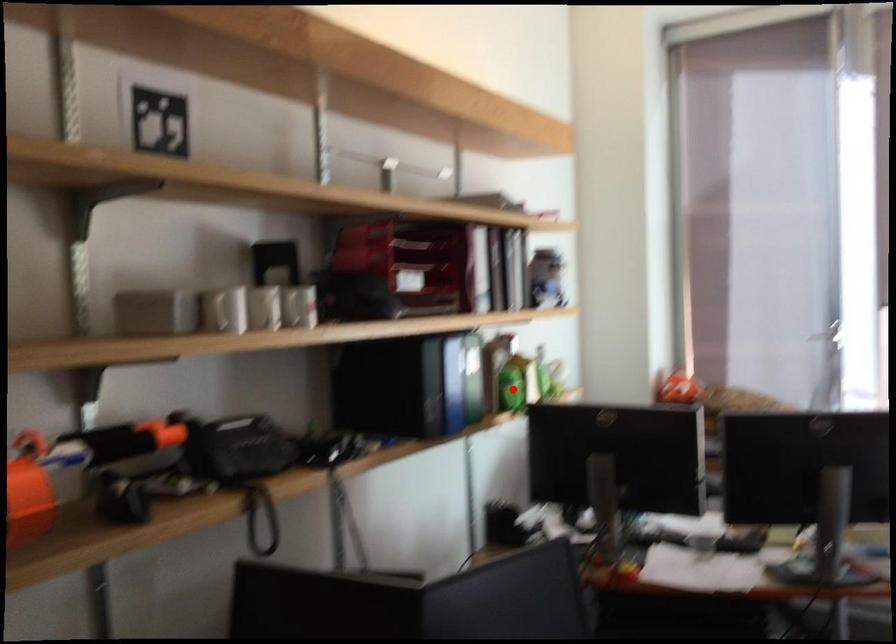
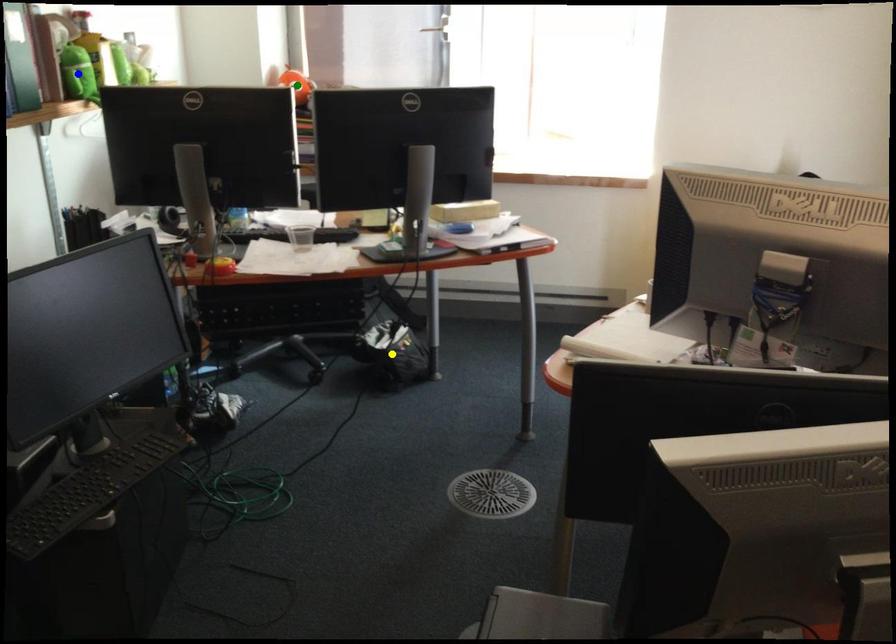
Question: I am providing you with two images of the same scene from different viewpoints. A red point is marked on the first image. You are given multiple points on the second image. Which mark in image 2 goes with the point in image 1?

Choices:
 (A) yellow point
 (B) green point
 (C) blue point

Answer: (C)